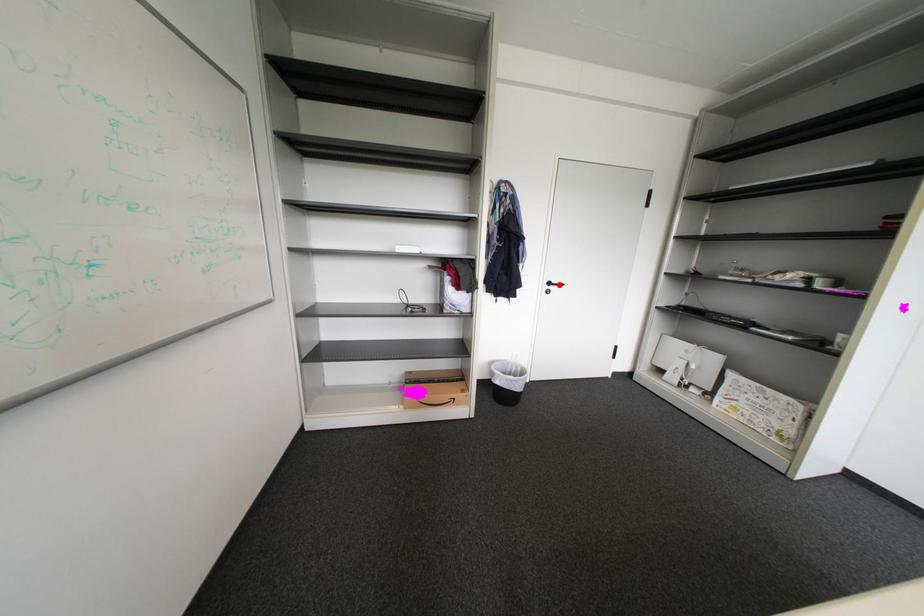
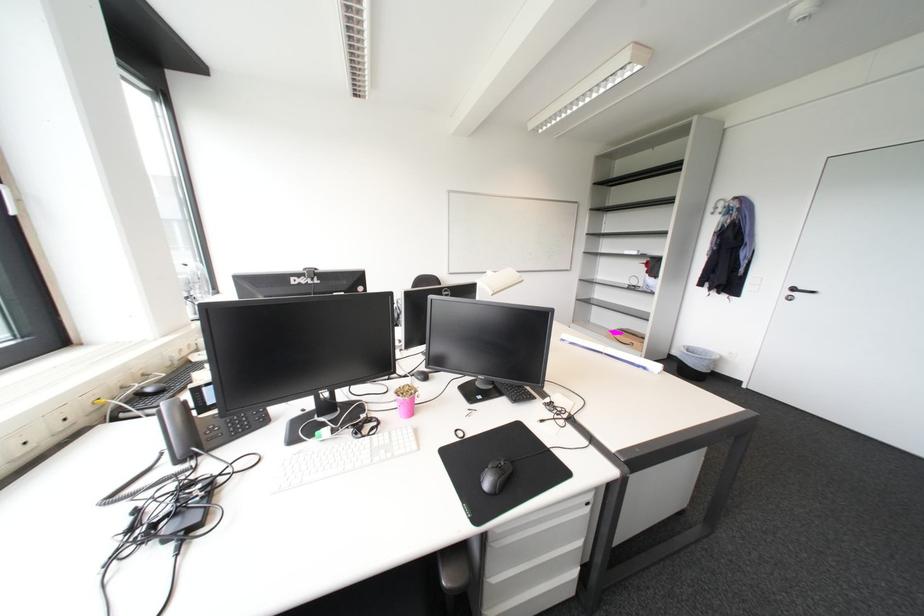
Question: I am providing you with two images of the same scene from different viewpoints. A red point is marked on the first image. Can you still see the location of the red point in image 2?

Choices:
 (A) Yes
 (B) No

Answer: (A)